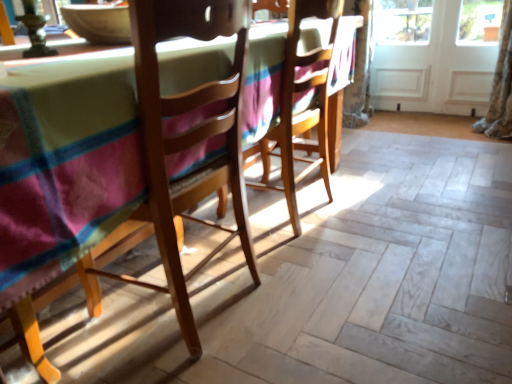
Question: Does point (313, 54) appear closer or farther from the camera than point (224, 119)?

Choices:
 (A) farther
 (B) closer

Answer: (A)

Question: Considering the positions of wooden chair at center, the first chair from the back, and wooden chair at left, the second chair viewed from the back, in the image, is wooden chair at center, the first chair from the back, bigger or smaller than wooden chair at left, the second chair viewed from the back,?

Choices:
 (A) small
 (B) big

Answer: (B)

Question: Estimate the real-world distances between objects in this image. Which object is farther from the wooden chair at left, the second chair viewed from the back?

Choices:
 (A) wooden chair at center, the first chair from the back
 (B) white wood screen door at upper right, which is the first screen door in right-to-left order
 (C) white wooden screen door at right, arranged as the first screen door when viewed from the left

Answer: (C)

Question: Which object is the closest to the wooden chair at center, the 2th chair when ordered from front to back?

Choices:
 (A) wooden chair at left, acting as the 1th chair starting from the front
 (B) white wooden screen door at right, marked as the second screen door in a right-to-left arrangement
 (C) white wood screen door at upper right, which is the 2th screen door from left to right

Answer: (A)